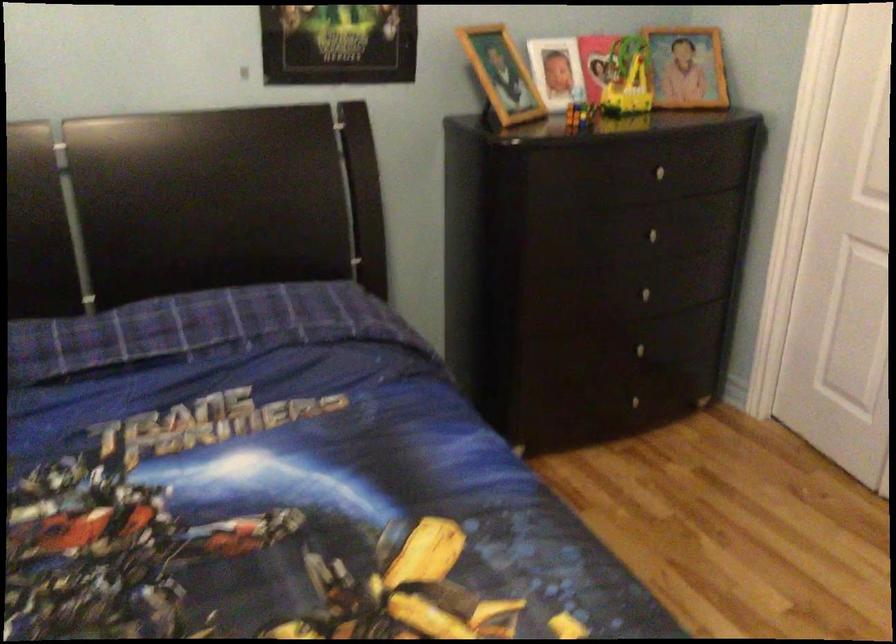
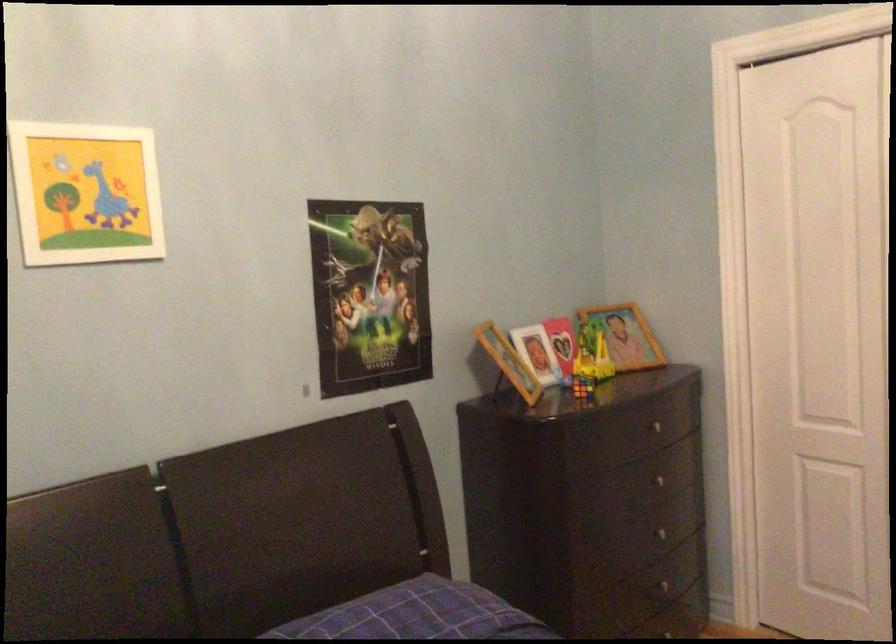
Question: The images are taken continuously from a first-person perspective. In which direction are you moving?

Choices:
 (A) Left
 (B) Right
 (C) Forward
 (D) Backward

Answer: (A)